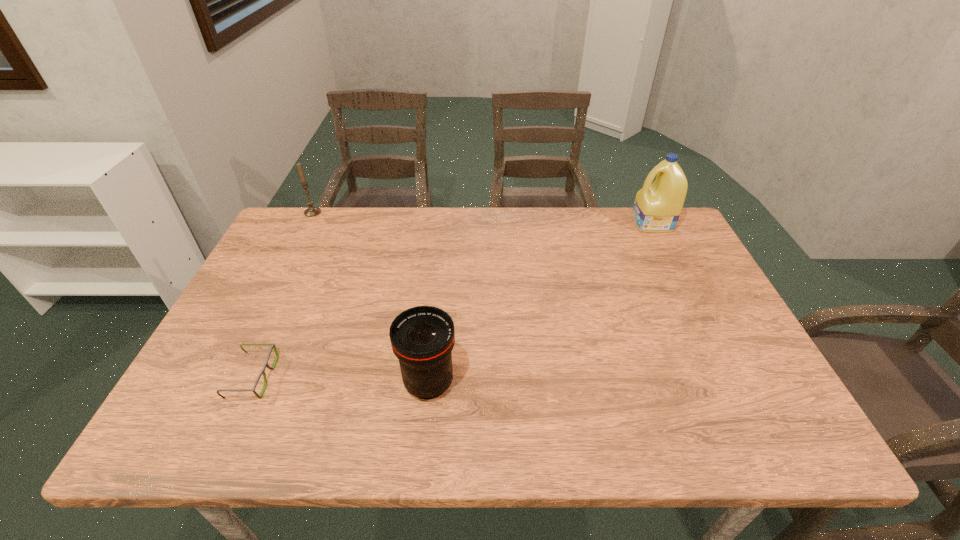
You are a GUI agent. You are given a task and a screenshot of the screen. Output one action in this format:
    pyautogui.click(x=<x>, y=<y>)
    Task: Click on the tallest object
    This screenshot has width=960, height=540.
    Given the screenshot: What is the action you would take?
    [x=657, y=207]

Locate an element on the screen. the rightmost object is located at coordinates (657, 207).

The height and width of the screenshot is (540, 960). I want to click on candle, so click(x=312, y=211).

Image resolution: width=960 pixels, height=540 pixels. What are the coordinates of `telephoto lens` in the screenshot? It's located at (422, 337).

The height and width of the screenshot is (540, 960). Identify the location of spectacles. (272, 345).

Find the location of a particular element. The width and height of the screenshot is (960, 540). free region located on the label of the tallest object is located at coordinates (573, 223).

This screenshot has width=960, height=540. What are the coordinates of `vacant space located on the label of the tallest object` in the screenshot? It's located at (609, 223).

Identify the location of free spot located 0.280m on the label of the tallest object. The height and width of the screenshot is (540, 960). (545, 223).

The height and width of the screenshot is (540, 960). I want to click on blank area located on the front of the candle, so click(304, 230).

The image size is (960, 540). What are the coordinates of `free region located on the front of the telephoto lens` in the screenshot? It's located at (422, 445).